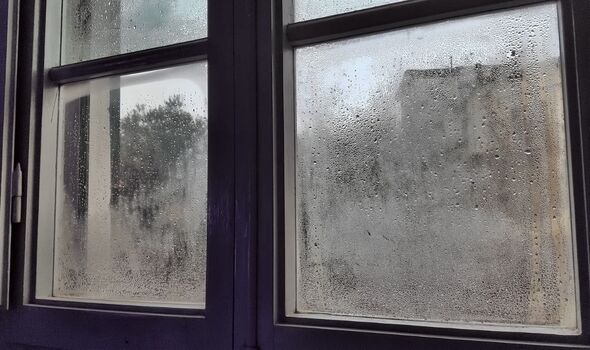
Locate an element on the screen. This screenshot has width=590, height=350. window hinges is located at coordinates (15, 190).